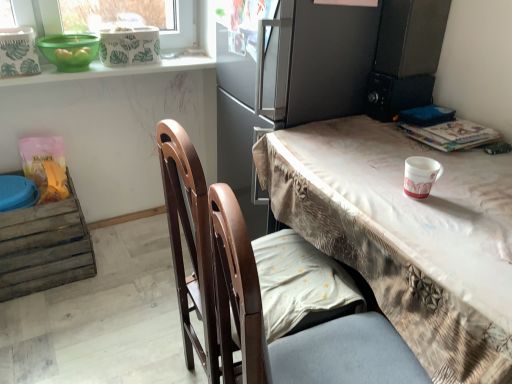
Find the location of a particular element. The image size is (512, 384). vacant space to the right of white paper cup at right is located at coordinates (470, 194).